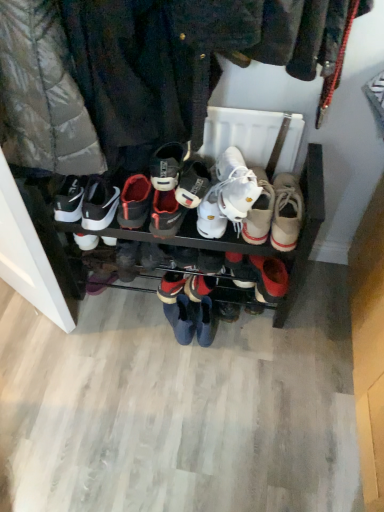
I want to click on vacant area situated to the left side of blue suede boots at center, the fourth footwear viewed from the left, so click(135, 313).